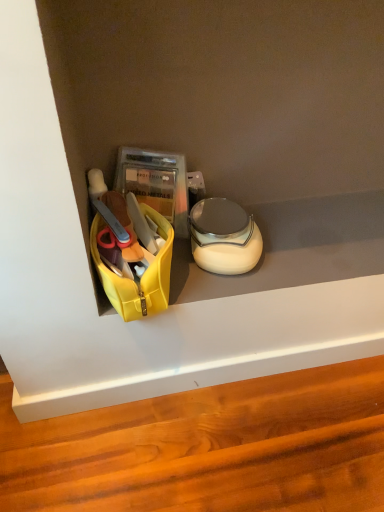
I want to click on vacant area located to the right-hand side of white glossy jar at center, so pos(298,246).